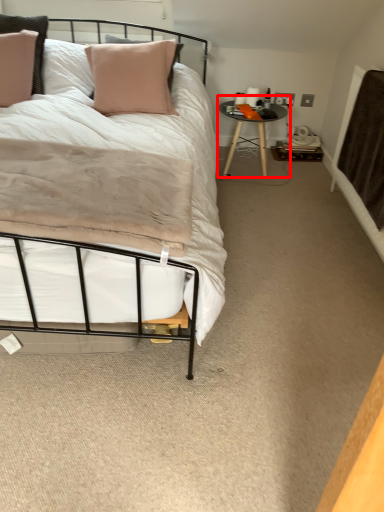
Question: Where is table (annotated by the red box) located in relation to blanket in the image?

Choices:
 (A) right
 (B) left

Answer: (B)